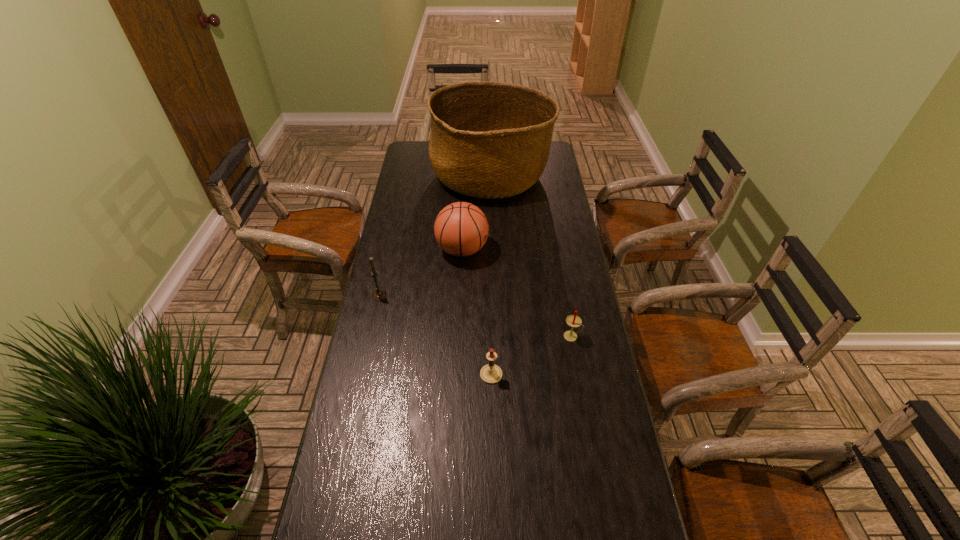
Locate an element on the screen. free space that satisfies the following two spatial constraints: 1. on the back side of the rightmost candle; 2. on the left side of the second candle from left to right is located at coordinates coord(491,336).